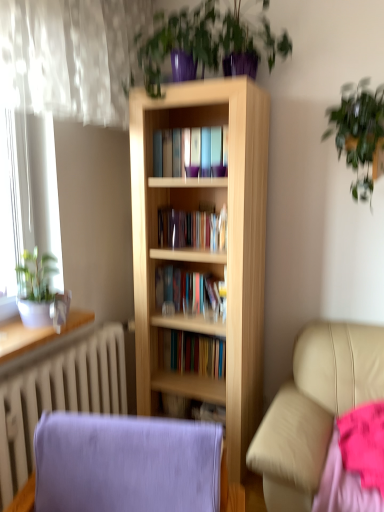
Locate an element on the screen. This screenshot has width=384, height=512. pink fabric at lower right is located at coordinates (354, 463).

You are a GUI agent. You are given a task and a screenshot of the screen. Output one action in this format:
    pyautogui.click(x=<x>, y=<y>)
    Task: Click on the white matte radiator at lower left
    
    Given the screenshot: What is the action you would take?
    pyautogui.click(x=58, y=397)

This screenshot has width=384, height=512. I want to click on purple glossy plant at upper center, which is counted as the second houseplant, starting from the right, so [207, 44].

Considering the positions of points (8, 355) and (290, 48), is point (8, 355) farther from camera compared to point (290, 48)?

No, it is not.

Does white glossy radiator at lower left turn towards purple glossy plant at upper center, arranged as the 3th houseplant when ordered from the bottom?

No, white glossy radiator at lower left is not aimed at purple glossy plant at upper center, arranged as the 3th houseplant when ordered from the bottom.

Is white glossy radiator at lower left wider or thinner than purple glossy plant at upper center, which is counted as the second houseplant, starting from the right?

In the image, white glossy radiator at lower left appears to be more narrow than purple glossy plant at upper center, which is counted as the second houseplant, starting from the right.

Which object is further away from the camera, white glossy radiator at lower left or purple glossy plant at upper center, which ranks as the second houseplant in left-to-right order?

purple glossy plant at upper center, which ranks as the second houseplant in left-to-right order, is further from the camera.

Which is behind, green matte plant at left, the first houseplant in the bottom-to-top sequence, or white matte radiator at lower left?

green matte plant at left, the first houseplant in the bottom-to-top sequence, is behind.

Identify the location of houseplant on the left of white matte radiator at lower left. Image resolution: width=384 pixels, height=512 pixels. (41, 292).

Which of these two, green matte plant at left, which is the 3th houseplant from right to left, or white matte radiator at lower left, is bigger?

white matte radiator at lower left.

Is green matte plant at left, the first houseplant in the left-to-right sequence, not close to green leafy plant at upper right, the first houseplant positioned from the right?

green matte plant at left, the first houseplant in the left-to-right sequence, is positioned a significant distance from green leafy plant at upper right, the first houseplant positioned from the right.

Is green matte plant at left, the first houseplant in the bottom-to-top sequence, further to camera compared to green leafy plant at upper right, the 2th houseplant ordered from the bottom?

Yes, green matte plant at left, the first houseplant in the bottom-to-top sequence, is behind green leafy plant at upper right, the 2th houseplant ordered from the bottom.

Is point (46, 280) closer or farther from the camera than point (350, 123)?

Point (46, 280) is positioned farther from the camera compared to point (350, 123).

Between green matte plant at left, the first houseplant in the bottom-to-top sequence, and green leafy plant at upper right, the second houseplant from the top, which one appears on the left side from the viewer's perspective?

Positioned to the left is green matte plant at left, the first houseplant in the bottom-to-top sequence.

Considering the sizes of objects pink fabric at lower right and white matte radiator at lower left in the image provided, who is bigger, pink fabric at lower right or white matte radiator at lower left?

Bigger between the two is white matte radiator at lower left.

Would you consider pink fabric at lower right to be distant from white matte radiator at lower left?

Yes, pink fabric at lower right is far from white matte radiator at lower left.

Where is `radiator behind the pink fabric at lower right`? This screenshot has width=384, height=512. radiator behind the pink fabric at lower right is located at coordinates click(58, 397).

Which object is closer to the camera taking this photo, pink fabric at lower right or white matte radiator at lower left?

pink fabric at lower right is closer to the camera.

Which object is wider, pink fabric at lower right or white glossy radiator at lower left?

Wider between the two is pink fabric at lower right.

Is the position of pink fabric at lower right less distant than that of white glossy radiator at lower left?

That is True.

Considering the points (350, 433) and (32, 332), which point is behind, point (350, 433) or point (32, 332)?

The point (32, 332) is farther.

Which is more to the left, pink fabric at lower right or white glossy radiator at lower left?

From the viewer's perspective, white glossy radiator at lower left appears more on the left side.

Is point (248, 74) in front of point (0, 413)?

No, (248, 74) is further to viewer.

Do you think purple glossy plant at upper center, the first houseplant from the top, is within white matte radiator at lower left, or outside of it?

purple glossy plant at upper center, the first houseplant from the top, is located beyond the bounds of white matte radiator at lower left.

How many degrees apart are the facing directions of purple glossy plant at upper center, the first houseplant from the top, and white matte radiator at lower left?

They differ by 89.1 degrees in their facing directions.

The width and height of the screenshot is (384, 512). What are the coordinates of `radiator in front of the purple glossy plant at upper center, which ranks as the second houseplant in left-to-right order` in the screenshot? It's located at (58, 397).

Is the depth of green leafy plant at upper right, the 2th houseplant ordered from the bottom, greater than that of purple glossy plant at upper center, which is counted as the second houseplant, starting from the right?

That is True.

Can you confirm if green leafy plant at upper right, the second houseplant from the top, is thinner than purple glossy plant at upper center, arranged as the 3th houseplant when ordered from the bottom?

Yes.

In the scene shown: Which of these two, green leafy plant at upper right, the second houseplant from the top, or purple glossy plant at upper center, which ranks as the second houseplant in left-to-right order, is bigger?

purple glossy plant at upper center, which ranks as the second houseplant in left-to-right order.

Where is `the 1st houseplant behind the white glossy radiator at lower left, counting from the anchor's position`? The image size is (384, 512). the 1st houseplant behind the white glossy radiator at lower left, counting from the anchor's position is located at coordinates (207, 44).

You are a GUI agent. You are given a task and a screenshot of the screen. Output one action in this format:
    pyautogui.click(x=<x>, y=<y>)
    Task: Click on the houseplant that is the 1st one when counting upward from the white matte radiator at lower left (from the image's perspective)
    The image size is (384, 512).
    Given the screenshot: What is the action you would take?
    pyautogui.click(x=41, y=292)

Looking at the image, which one is located closer to purple glossy plant at upper center, the first houseplant from the top, green matte plant at left, the first houseplant in the bottom-to-top sequence, or green leafy plant at upper right, the first houseplant positioned from the right?

Based on the image, green leafy plant at upper right, the first houseplant positioned from the right, appears to be nearer to purple glossy plant at upper center, the first houseplant from the top.

Which object lies nearer to the anchor point white glossy radiator at lower left, green matte plant at left, the first houseplant in the left-to-right sequence, or green leafy plant at upper right, the second houseplant from the top?

green matte plant at left, the first houseplant in the left-to-right sequence.

From the image, which object appears to be nearer to white glossy radiator at lower left, green matte plant at left, which is the 3th houseplant from right to left, or purple glossy plant at upper center, the first houseplant from the top?

Based on the image, green matte plant at left, which is the 3th houseplant from right to left, appears to be nearer to white glossy radiator at lower left.

Based on their spatial positions, is green leafy plant at upper right, the 2th houseplant ordered from the bottom, or white matte radiator at lower left further from purple fabric rocking chair at lower left?

green leafy plant at upper right, the 2th houseplant ordered from the bottom, is further to purple fabric rocking chair at lower left.

Which object lies nearer to the anchor point green matte plant at left, the first houseplant in the bottom-to-top sequence, purple glossy plant at upper center, the first houseplant from the top, or purple fabric rocking chair at lower left?

Among the two, purple fabric rocking chair at lower left is located nearer to green matte plant at left, the first houseplant in the bottom-to-top sequence.

Based on their spatial positions, is pink fabric at lower right or purple glossy plant at upper center, arranged as the 3th houseplant when ordered from the bottom, further from green matte plant at left, which is the 3th houseplant from right to left?

pink fabric at lower right is further to green matte plant at left, which is the 3th houseplant from right to left.

Looking at the image, which one is located closer to pink fabric at lower right, light wood bookcase at center or green matte plant at left, which appears as the third houseplant when viewed from the top?

light wood bookcase at center is closer to pink fabric at lower right.

From the image, which object appears to be farther from green matte plant at left, the first houseplant in the left-to-right sequence, green leafy plant at upper right, the third houseplant in the left-to-right sequence, or white matte radiator at lower left?

The object further to green matte plant at left, the first houseplant in the left-to-right sequence, is green leafy plant at upper right, the third houseplant in the left-to-right sequence.

I want to click on radiator between white glossy radiator at lower left and pink fabric at lower right from left to right, so click(58, 397).

You are a GUI agent. You are given a task and a screenshot of the screen. Output one action in this format:
    pyautogui.click(x=<x>, y=<y>)
    Task: Click on the bookcase between green leafy plant at upper right, the 2th houseplant ordered from the bottom, and purple fabric rocking chair at lower left from top to bottom
    This screenshot has width=384, height=512.
    Given the screenshot: What is the action you would take?
    pyautogui.click(x=205, y=250)

You are a GUI agent. You are given a task and a screenshot of the screen. Output one action in this format:
    pyautogui.click(x=<x>, y=<y>)
    Task: Click on the radiator between green leafy plant at upper right, the first houseplant positioned from the right, and purple fabric rocking chair at lower left, in the vertical direction
    
    Given the screenshot: What is the action you would take?
    pyautogui.click(x=58, y=397)

At what (x,y) coordinates should I click in order to perform the action: click on radiator between green matte plant at left, the first houseplant in the left-to-right sequence, and pink fabric at lower right. Please return your answer as a coordinate pair (x, y). This screenshot has width=384, height=512. Looking at the image, I should click on (58, 397).